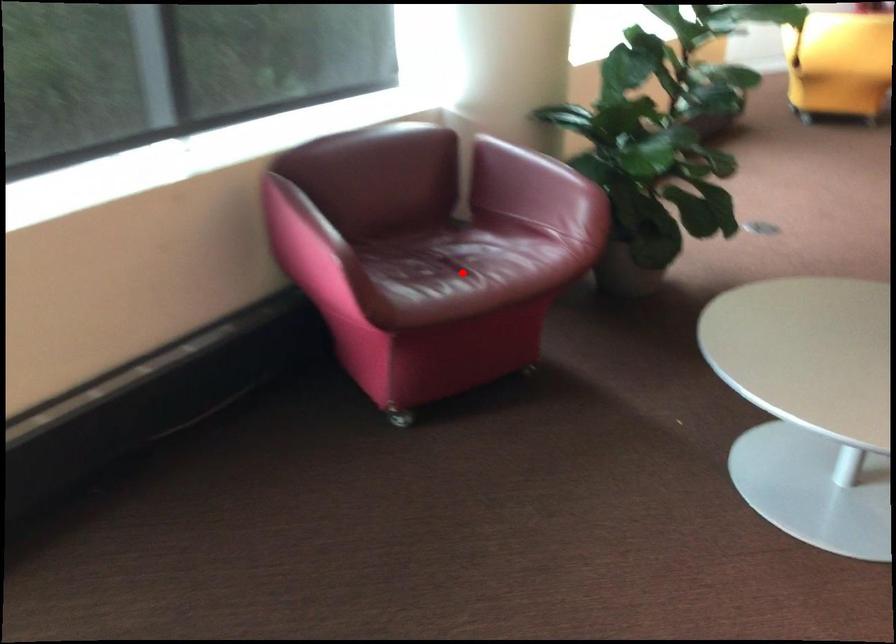
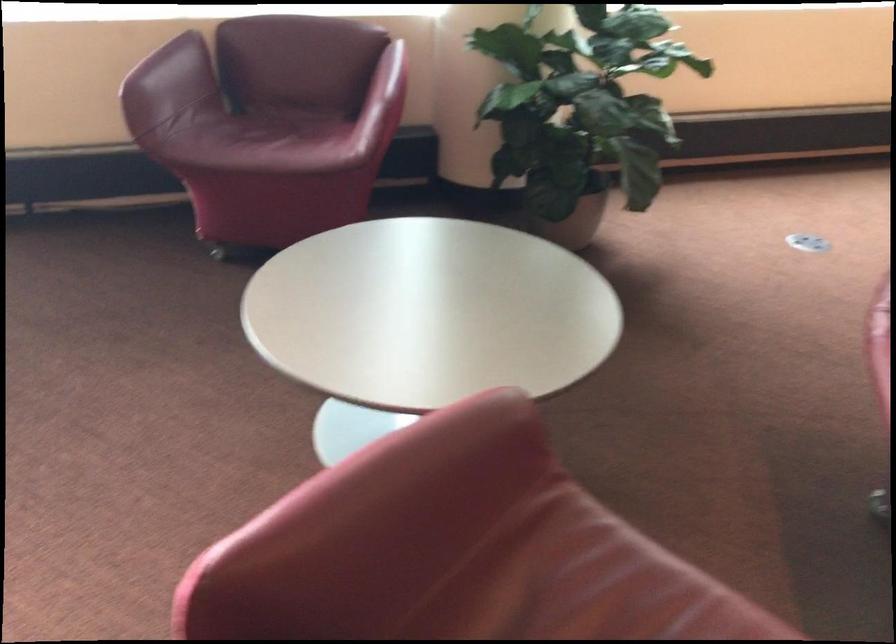
Question: I am providing you with two images of the same scene from different viewpoints. A red point is marked on the first image. At the location where the point appears in image 1, is it still visible in image 2?

Choices:
 (A) Yes
 (B) No

Answer: (A)